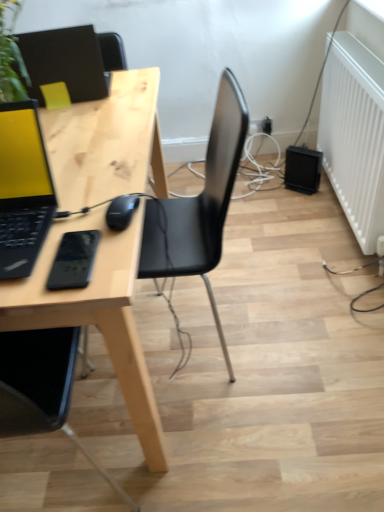
How much space does matte black laptop at left, placed as the first laptop when sorted from bottom to top, occupy horizontally?

It is 12.02 inches.

You are a GUI agent. You are given a task and a screenshot of the screen. Output one action in this format:
    pyautogui.click(x=<x>, y=<y>)
    Task: Click on the black plastic speaker at lower right
    Image resolution: width=384 pixels, height=512 pixels.
    Given the screenshot: What is the action you would take?
    pyautogui.click(x=302, y=169)

What do you see at coordinates (354, 135) in the screenshot? I see `white matte radiator at right` at bounding box center [354, 135].

Describe the element at coordinates (267, 125) in the screenshot. I see `black plastic electric outlet at lower right` at that location.

Image resolution: width=384 pixels, height=512 pixels. I want to click on black matte mouse at center, so click(121, 211).

Describe the element at coordinates (96, 314) in the screenshot. I see `light wood desk at center` at that location.

In order to click on matte black laptop at upper left, arranged as the 1th laptop when viewed from the back in this screenshot , I will do 65,62.

Locate an element on the screen. matte black laptop at left, acting as the 2th laptop starting from the top is located at coordinates (23, 189).

Is white matte radiator at right at the back of matte black laptop at upper left, arranged as the 1th laptop when viewed from the back?

No.

Considering the sizes of objects matte black laptop at upper left, placed as the second laptop when sorted from bottom to top, and white matte radiator at right in the image provided, who is shorter, matte black laptop at upper left, placed as the second laptop when sorted from bottom to top, or white matte radiator at right?

matte black laptop at upper left, placed as the second laptop when sorted from bottom to top.

Which is farther, (101, 78) or (372, 185)?

Point (372, 185)

From the image's perspective, does matte black laptop at upper left, arranged as the 1th laptop when viewed from the back, appear higher than white matte radiator at right?

Yes, from the image's perspective, matte black laptop at upper left, arranged as the 1th laptop when viewed from the back, is above white matte radiator at right.

From the image's perspective, does white matte radiator at right appear higher than matte black laptop at upper left, which ranks as the 1th laptop in top-to-bottom order?

Incorrect, from the image's perspective, white matte radiator at right is lower than matte black laptop at upper left, which ranks as the 1th laptop in top-to-bottom order.

Which is closer to the camera, (336, 64) or (98, 44)?

Clearly, point (336, 64) is closer to the camera than point (98, 44).

Looking at their sizes, would you say white matte radiator at right is wider or thinner than matte black laptop at upper left, the second laptop in the front-to-back sequence?

In the image, white matte radiator at right appears to be more narrow than matte black laptop at upper left, the second laptop in the front-to-back sequence.

Is white matte radiator at right positioned far away from matte black laptop at upper left, placed as the second laptop when sorted from bottom to top?

No, white matte radiator at right is in close proximity to matte black laptop at upper left, placed as the second laptop when sorted from bottom to top.

Is light wood desk at center smaller than black plastic speaker at lower right?

No, light wood desk at center is not smaller than black plastic speaker at lower right.

Measure the distance between light wood desk at center and black plastic speaker at lower right.

light wood desk at center and black plastic speaker at lower right are 1.17 meters apart from each other.

Can you see light wood desk at center touching black plastic speaker at lower right?

No, light wood desk at center is not making contact with black plastic speaker at lower right.

Does black plastic electric outlet at lower right turn towards light wood desk at center?

No, black plastic electric outlet at lower right is not oriented towards light wood desk at center.

Can you confirm if black plastic electric outlet at lower right is wider than light wood desk at center?

No.

Does black plastic electric outlet at lower right appear on the right side of light wood desk at center?

Indeed, black plastic electric outlet at lower right is positioned on the right side of light wood desk at center.

Is black plastic electric outlet at lower right taller than light wood desk at center?

Incorrect, the height of black plastic electric outlet at lower right is not larger of that of light wood desk at center.

Is matte black laptop at left, acting as the 2th laptop starting from the back, spatially inside light wood desk at center, or outside of it?

matte black laptop at left, acting as the 2th laptop starting from the back, is not enclosed by light wood desk at center.

Is point (11, 131) closer or farther from the camera than point (127, 228)?

Clearly, point (11, 131) is more distant from the camera than point (127, 228).

In the image, is matte black laptop at left, acting as the 2th laptop starting from the top, positioned in front of or behind light wood desk at center?

matte black laptop at left, acting as the 2th laptop starting from the top, is in front of light wood desk at center.

From a real-world perspective, is matte black laptop at left, acting as the 2th laptop starting from the top, under light wood desk at center?

No, from a real-world perspective, matte black laptop at left, acting as the 2th laptop starting from the top, is not below light wood desk at center.

From a real-world perspective, is black plastic electric outlet at lower right on top of matte black laptop at upper left, which ranks as the 1th laptop in top-to-bottom order?

Incorrect, from a real-world perspective, black plastic electric outlet at lower right is lower than matte black laptop at upper left, which ranks as the 1th laptop in top-to-bottom order.

Considering the relative positions of black plastic electric outlet at lower right and matte black laptop at upper left, the second laptop in the front-to-back sequence, in the image provided, is black plastic electric outlet at lower right to the right of matte black laptop at upper left, the second laptop in the front-to-back sequence, from the viewer's perspective?

Yes, black plastic electric outlet at lower right is to the right of matte black laptop at upper left, the second laptop in the front-to-back sequence.

Does black plastic electric outlet at lower right have a greater width compared to matte black laptop at upper left, arranged as the 1th laptop when viewed from the back?

No.

From the picture: Is matte black laptop at upper left, placed as the second laptop when sorted from bottom to top, not inside light wood desk at center?

matte black laptop at upper left, placed as the second laptop when sorted from bottom to top, is positioned outside light wood desk at center.

Considering their positions, is matte black laptop at upper left, arranged as the 1th laptop when viewed from the back, located in front of or behind light wood desk at center?

matte black laptop at upper left, arranged as the 1th laptop when viewed from the back, is behind light wood desk at center.

Is matte black laptop at upper left, arranged as the 1th laptop when viewed from the back, wider or thinner than light wood desk at center?

matte black laptop at upper left, arranged as the 1th laptop when viewed from the back, is thinner than light wood desk at center.

In the scene shown: Is matte black laptop at upper left, the second laptop in the front-to-back sequence, positioned with its back to light wood desk at center?

That's not correct — matte black laptop at upper left, the second laptop in the front-to-back sequence, is not looking away from light wood desk at center.

The image size is (384, 512). Find the location of `radiator on the right of matte black laptop at upper left, arranged as the 1th laptop when viewed from the back`. radiator on the right of matte black laptop at upper left, arranged as the 1th laptop when viewed from the back is located at coordinates (354, 135).

At what (x,y) coordinates should I click in order to perform the action: click on laptop that is the 2nd one above the white matte radiator at right (from a real-world perspective). Please return your answer as a coordinate pair (x, y). Image resolution: width=384 pixels, height=512 pixels. Looking at the image, I should click on (65, 62).

Looking at the image, which one is located closer to black plastic electric outlet at lower right, black plastic speaker at lower right or black matte mouse at center?

black plastic speaker at lower right lies closer to black plastic electric outlet at lower right than the other object.

When comparing their distances from white matte radiator at right, does light wood desk at center or matte black laptop at left, acting as the 2th laptop starting from the back, seem further?

matte black laptop at left, acting as the 2th laptop starting from the back, lies further to white matte radiator at right than the other object.

Based on their spatial positions, is black plastic speaker at lower right or black matte mouse at center further from matte black laptop at upper left, placed as the second laptop when sorted from bottom to top?

black plastic speaker at lower right is positioned further to the anchor matte black laptop at upper left, placed as the second laptop when sorted from bottom to top.

Which object lies further to the anchor point matte black laptop at left, placed as the first laptop when sorted from bottom to top, white matte radiator at right or light wood desk at center?

Among the two, white matte radiator at right is located further to matte black laptop at left, placed as the first laptop when sorted from bottom to top.

Considering their positions, is white matte radiator at right positioned closer to matte black laptop at upper left, placed as the second laptop when sorted from bottom to top, than black matte mouse at center?

black matte mouse at center.

Considering their positions, is black plastic electric outlet at lower right positioned further to black plastic speaker at lower right than matte black laptop at upper left, which ranks as the 1th laptop in top-to-bottom order?

matte black laptop at upper left, which ranks as the 1th laptop in top-to-bottom order.

When comparing their distances from light wood desk at center, does black matte mouse at center or white matte radiator at right seem further?

white matte radiator at right.

Looking at the image, which one is located further to white matte radiator at right, matte black laptop at upper left, which ranks as the 1th laptop in top-to-bottom order, or black matte mouse at center?

black matte mouse at center is positioned further to the anchor white matte radiator at right.

Find the location of `laptop positioned between black matte mouse at center and black plastic speaker at lower right from near to far`. laptop positioned between black matte mouse at center and black plastic speaker at lower right from near to far is located at coordinates (65, 62).

Identify the location of mouse between matte black laptop at upper left, which ranks as the 1th laptop in top-to-bottom order, and white matte radiator at right, in the horizontal direction. This screenshot has height=512, width=384. (121, 211).

Find the location of a particular element. The width and height of the screenshot is (384, 512). mouse between matte black laptop at left, acting as the 2th laptop starting from the back, and black plastic electric outlet at lower right from front to back is located at coordinates (121, 211).

Locate an element on the screen. Image resolution: width=384 pixels, height=512 pixels. laptop between matte black laptop at left, acting as the 2th laptop starting from the back, and black plastic speaker at lower right, along the z-axis is located at coordinates [x=65, y=62].